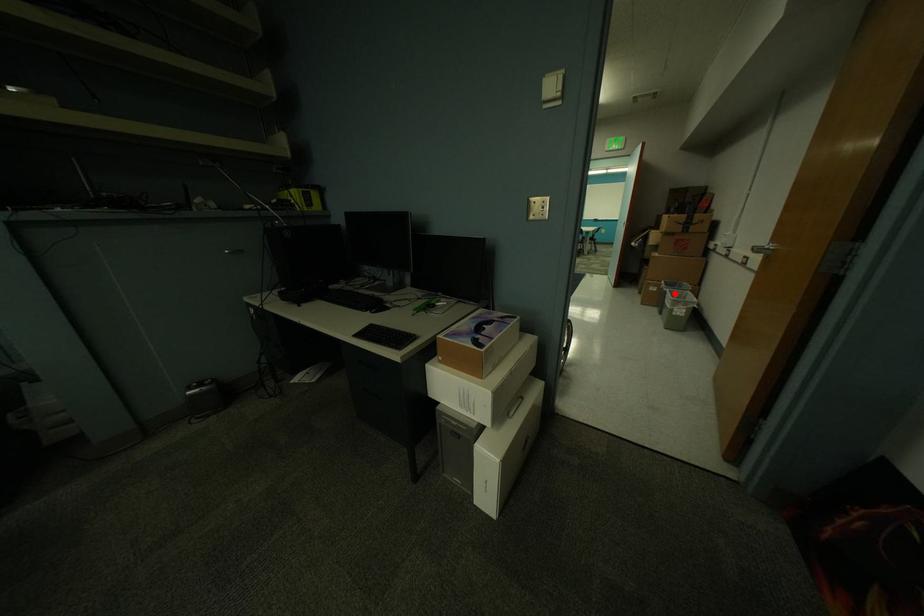
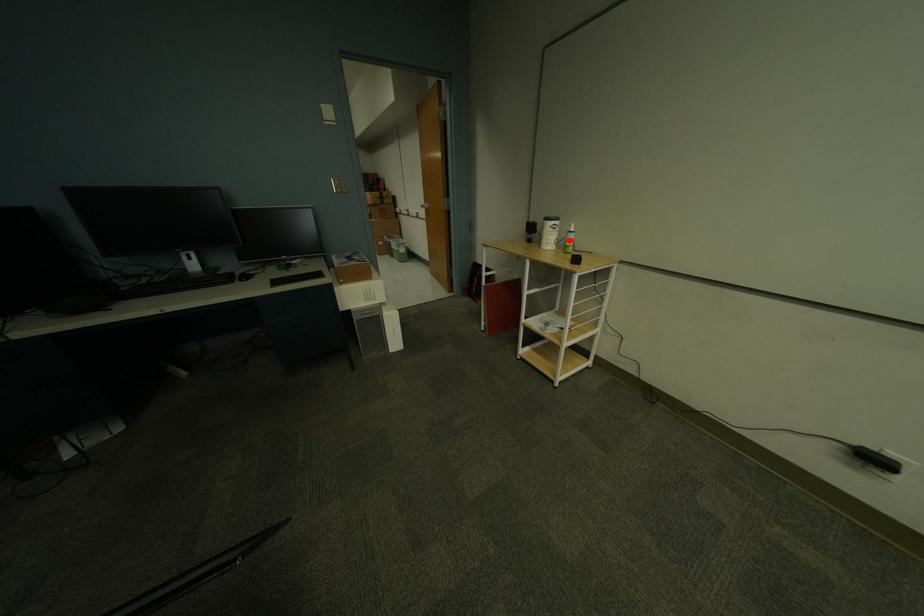
I am providing you with two images of the same scene from different viewpoints. A red point is marked on the first image and another point is marked on the second image. Do the highlighted points in image1 and image2 indicate the same real-world spot?

No